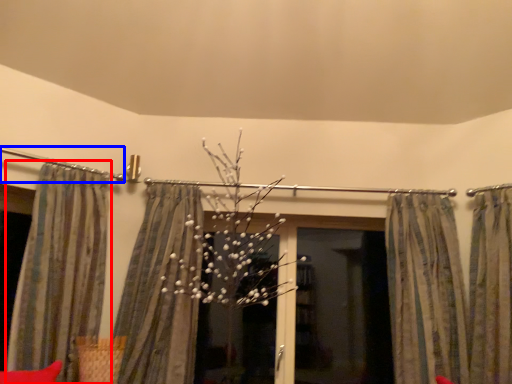
Question: Which of the following is the closest to the observer, curtain (highlighted by a red box) or clothesline (highlighted by a blue box)?

Choices:
 (A) curtain
 (B) clothesline

Answer: (A)